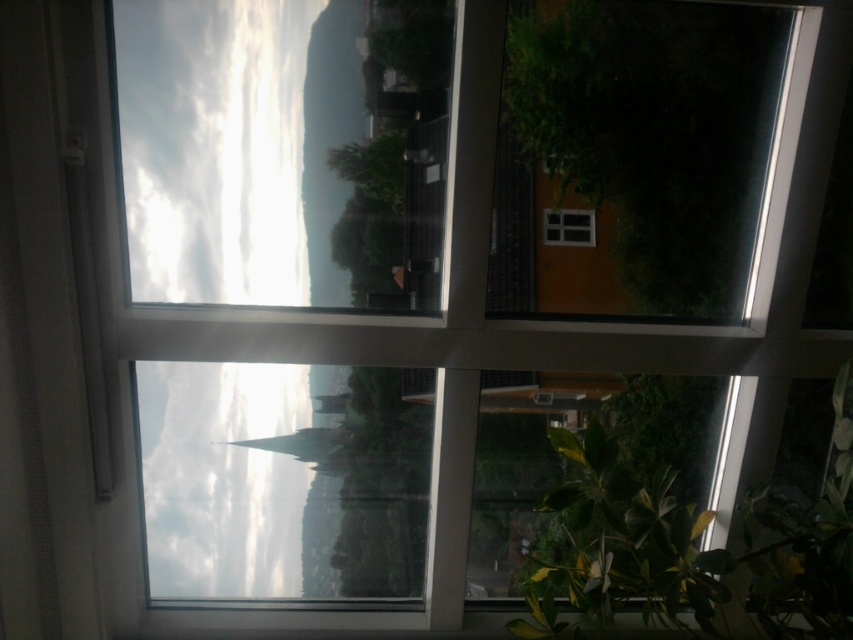
Does green leafy plant at lower right appear under clear glass window at center?

Indeed, green leafy plant at lower right is positioned under clear glass window at center.

Which is below, green leafy plant at lower right or clear glass window at center?

green leafy plant at lower right is lower down.

What do you see at coordinates (621, 547) in the screenshot? I see `green leafy plant at lower right` at bounding box center [621, 547].

The height and width of the screenshot is (640, 853). I want to click on green leafy plant at lower right, so click(621, 547).